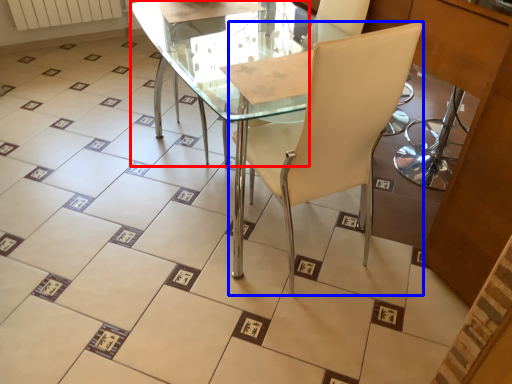
Question: Which object is closer to the camera taking this photo, round table (highlighted by a red box) or chair (highlighted by a blue box)?

Choices:
 (A) round table
 (B) chair

Answer: (B)